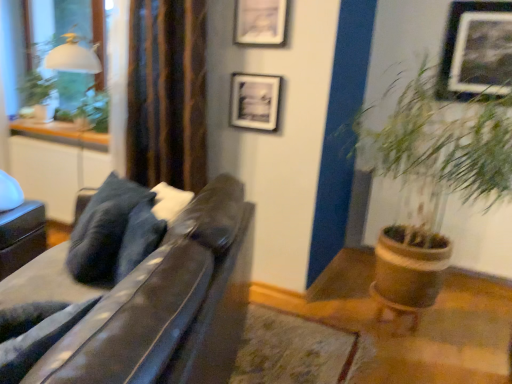
Describe the element at coordinates (477, 49) in the screenshot. Image resolution: width=512 pixels, height=384 pixels. I see `metallic silver picture frame at upper right, which is the third picture frame in left-to-right order` at that location.

Describe the element at coordinates (19, 227) in the screenshot. The image size is (512, 384). I see `matte black swivel chair at left` at that location.

Based on the photo, measure the distance between point (58, 133) and camera.

They are 3.25 meters apart.

At what (x,y) coordinates should I click in order to perform the action: click on matte black picture frame at upper center, placed as the first picture frame when sorted from left to right. Please return your answer as a coordinate pair (x, y). Looking at the image, I should click on (254, 101).

Can you tell me how much green leafy plant at upper left and matte black swivel chair at left differ in facing direction?

The facing directions of green leafy plant at upper left and matte black swivel chair at left are 19.8 degrees apart.

Is green leafy plant at upper left looking in the opposite direction of matte black swivel chair at left?

That's not correct — green leafy plant at upper left is not looking away from matte black swivel chair at left.

Can you confirm if green leafy plant at upper left is shorter than matte black swivel chair at left?

Indeed, green leafy plant at upper left has a lesser height compared to matte black swivel chair at left.

Are green leafy plant at upper left and matte black swivel chair at left located far from each other?

No.

Is there a large distance between matte black swivel chair at left and white glossy table at left?

No, matte black swivel chair at left is in close proximity to white glossy table at left.

Which is behind, point (1, 222) or point (26, 133)?

Positioned behind is point (26, 133).

Considering the positions of objects matte black swivel chair at left and white glossy table at left in the image provided, who is more to the left, matte black swivel chair at left or white glossy table at left?

Positioned to the left is matte black swivel chair at left.

Considering the relative sizes of leather couch at left and green leafy plant at upper left in the image provided, is leather couch at left bigger than green leafy plant at upper left?

Correct, leather couch at left is larger in size than green leafy plant at upper left.

Which object is closer to the camera, leather couch at left or green leafy plant at upper left?

leather couch at left is closer to the camera.

How many degrees apart are the facing directions of leather couch at left and green leafy plant at upper left?

They differ by 71.3 degrees in their facing directions.

Is leather couch at left facing away from green leafy plant at upper left?

No.

How many degrees apart are the facing directions of matte black swivel chair at left and brown striped curtain at upper left?

19.8 degrees.

Looking at this image, from a real-world perspective, is matte black swivel chair at left positioned under brown striped curtain at upper left based on gravity?

Yes, from a real-world perspective, matte black swivel chair at left is under brown striped curtain at upper left.

In the scene shown: From the image's perspective, is matte black swivel chair at left above or below brown striped curtain at upper left?

Based on their image positions, matte black swivel chair at left is located beneath brown striped curtain at upper left.

Locate an element on the screen. The image size is (512, 384). swivel chair lying below the brown striped curtain at upper left (from the image's perspective) is located at coordinates (19, 227).

Is point (479, 181) positioned after point (234, 96)?

No, (479, 181) is closer to viewer.

From a real-world perspective, between green leafy plant at right and matte black picture frame at upper center, placed as the first picture frame when sorted from left to right, who is vertically lower?

green leafy plant at right.

Is green leafy plant at right oriented away from matte black picture frame at upper center, placed as the first picture frame when sorted from left to right?

That's not correct — green leafy plant at right is not looking away from matte black picture frame at upper center, placed as the first picture frame when sorted from left to right.

From the image's perspective, is green leafy plant at right located above matte black picture frame at upper center, placed as the first picture frame when sorted from left to right?

No, from the image's perspective, green leafy plant at right is not on top of matte black picture frame at upper center, placed as the first picture frame when sorted from left to right.

Is the position of leather couch at left less distant than that of green leafy plant at right?

Yes, the depth of leather couch at left is less than that of green leafy plant at right.

From a real-world perspective, between leather couch at left and green leafy plant at right, who is vertically higher?

From a 3D spatial view, green leafy plant at right is above.

Between leather couch at left and green leafy plant at right, which one has less height?

leather couch at left.

Can you confirm if leather couch at left is thinner than green leafy plant at right?

In fact, leather couch at left might be wider than green leafy plant at right.

In the image, is dark blue fabric pillow at center positioned in front of or behind matte black swivel chair at left?

Visually, dark blue fabric pillow at center is located in front of matte black swivel chair at left.

Does dark blue fabric pillow at center turn towards matte black swivel chair at left?

No.

Consider the image. Is dark blue fabric pillow at center directly adjacent to matte black swivel chair at left?

No, dark blue fabric pillow at center is not beside matte black swivel chair at left.

Considering the sizes of dark blue fabric pillow at center and matte black swivel chair at left in the image, is dark blue fabric pillow at center wider or thinner than matte black swivel chair at left?

In the image, dark blue fabric pillow at center appears to be more narrow than matte black swivel chair at left.

Locate an element on the screen. plant located behind the matte black swivel chair at left is located at coordinates (88, 112).

This screenshot has height=384, width=512. Find the location of `swivel chair located on the left of white glossy table at left`. swivel chair located on the left of white glossy table at left is located at coordinates (19, 227).

Which object lies nearer to the anchor point matte black picture frame at upper center, which appears as the second picture frame when viewed from the left, metallic silver picture frame at upper right, acting as the first picture frame starting from the right, or matte black picture frame at upper center, placed as the first picture frame when sorted from left to right?

Based on the image, matte black picture frame at upper center, placed as the first picture frame when sorted from left to right, appears to be nearer to matte black picture frame at upper center, which appears as the second picture frame when viewed from the left.

Considering their positions, is white glossy table at left positioned closer to leather couch at left than matte black picture frame at upper center, placed as the first picture frame when sorted from left to right?

matte black picture frame at upper center, placed as the first picture frame when sorted from left to right, is closer to leather couch at left.

From the image, which object appears to be nearer to matte black swivel chair at left, green leafy plant at right or dark blue fabric pillow at center?

dark blue fabric pillow at center.

Looking at the image, which one is located further to green leafy plant at upper left, metallic silver picture frame at upper right, which is the third picture frame in left-to-right order, or green leafy plant at right?

Based on the image, metallic silver picture frame at upper right, which is the third picture frame in left-to-right order, appears to be further to green leafy plant at upper left.

Considering their positions, is matte black picture frame at upper center, marked as the 2th picture frame in a right-to-left arrangement, positioned further to matte black picture frame at upper center, which is the 3th picture frame from right to left, than metallic silver picture frame at upper right, acting as the first picture frame starting from the right?

Based on the image, metallic silver picture frame at upper right, acting as the first picture frame starting from the right, appears to be further to matte black picture frame at upper center, which is the 3th picture frame from right to left.

Based on their spatial positions, is matte black picture frame at upper center, marked as the 2th picture frame in a right-to-left arrangement, or green leafy plant at upper left closer to brown striped curtain at upper left?

The object closer to brown striped curtain at upper left is matte black picture frame at upper center, marked as the 2th picture frame in a right-to-left arrangement.

Which object lies nearer to the anchor point green leafy plant at upper left, matte black picture frame at upper center, placed as the first picture frame when sorted from left to right, or matte black picture frame at upper center, marked as the 2th picture frame in a right-to-left arrangement?

matte black picture frame at upper center, placed as the first picture frame when sorted from left to right, is positioned closer to the anchor green leafy plant at upper left.

When comparing their distances from green leafy plant at upper left, does dark blue fabric pillow at center or matte black swivel chair at left seem further?

The object further to green leafy plant at upper left is dark blue fabric pillow at center.

Where is `pillow situated between green leafy plant at upper left and matte black picture frame at upper center, which is the 3th picture frame from right to left, from left to right`? Image resolution: width=512 pixels, height=384 pixels. pillow situated between green leafy plant at upper left and matte black picture frame at upper center, which is the 3th picture frame from right to left, from left to right is located at coordinates (114, 233).

The image size is (512, 384). What are the coordinates of `curtain between green leafy plant at upper left and metallic silver picture frame at upper right, acting as the first picture frame starting from the right, in the horizontal direction` in the screenshot? It's located at (167, 93).

This screenshot has height=384, width=512. In order to click on swivel chair between dark blue fabric pillow at center and green leafy plant at upper left from front to back in this screenshot , I will do `click(19, 227)`.

Locate an element on the screen. The width and height of the screenshot is (512, 384). curtain between white glossy table at left and green leafy plant at right in the horizontal direction is located at coordinates (167, 93).